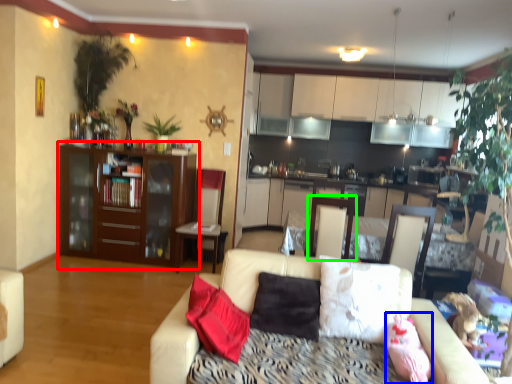
Question: Considering the real-world distances, which object is farthest from cabinetry (highlighted by a red box)? pillow (highlighted by a blue box) or swivel chair (highlighted by a green box)?

Choices:
 (A) pillow
 (B) swivel chair

Answer: (A)